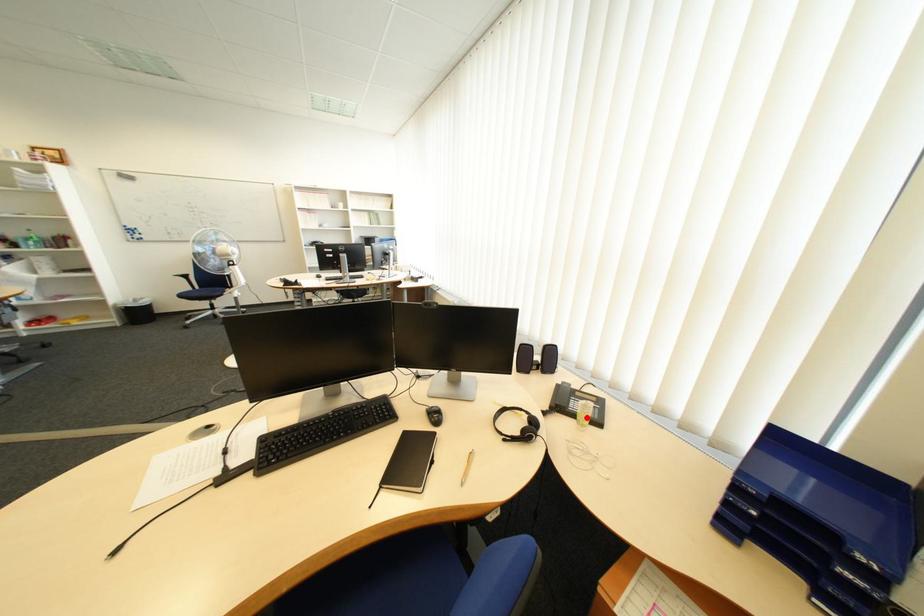
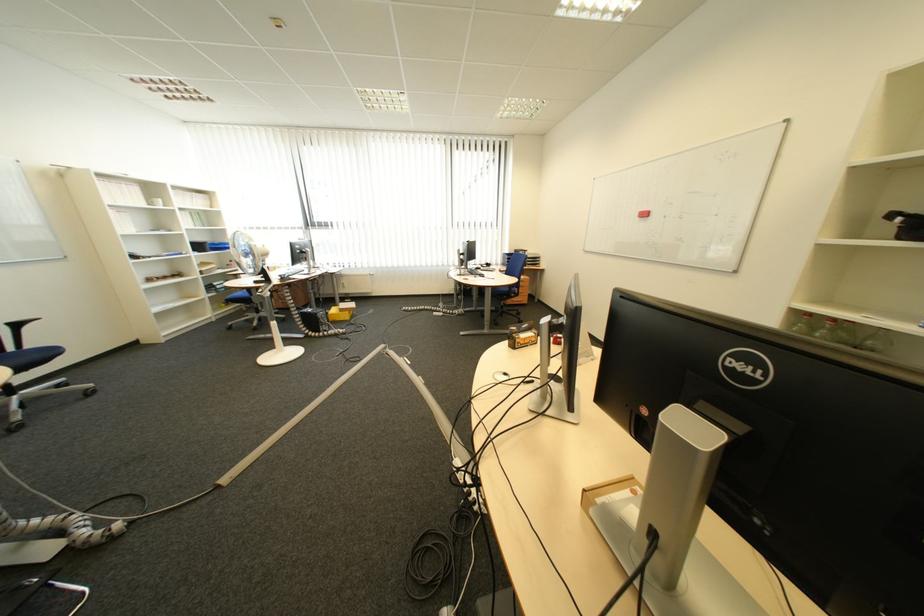
Question: I am providing you with two images of the same scene from different viewpoints. A red point is marked on the first image. Is the red point's position out of view in image 2?

Choices:
 (A) Yes
 (B) No

Answer: (A)